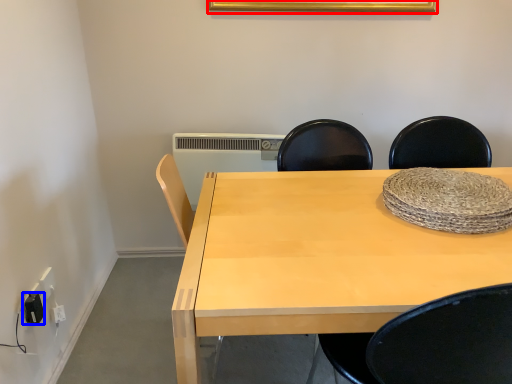
Question: Among these objects, which one is farthest to the camera, picture frame (highlighted by a red box) or electric outlet (highlighted by a blue box)?

Choices:
 (A) picture frame
 (B) electric outlet

Answer: (A)